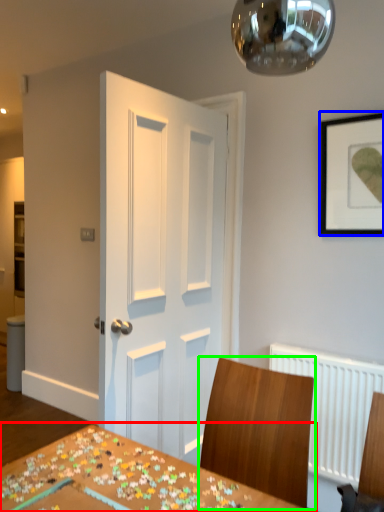
Question: Estimate the real-world distances between objects in this image. Which object is closer to table (highlighted by a red box), picture frame (highlighted by a blue box) or chair (highlighted by a green box)?

Choices:
 (A) picture frame
 (B) chair

Answer: (B)